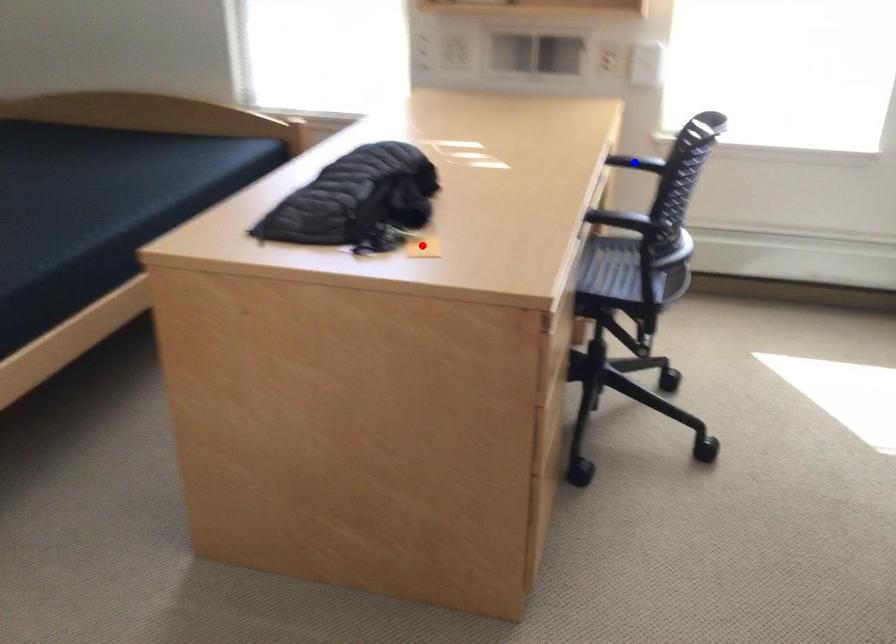
Question: In the image, two points are highlighted. Which point is nearer to the camera? Reply with the corresponding letter.

Choices:
 (A) blue point
 (B) red point

Answer: (B)